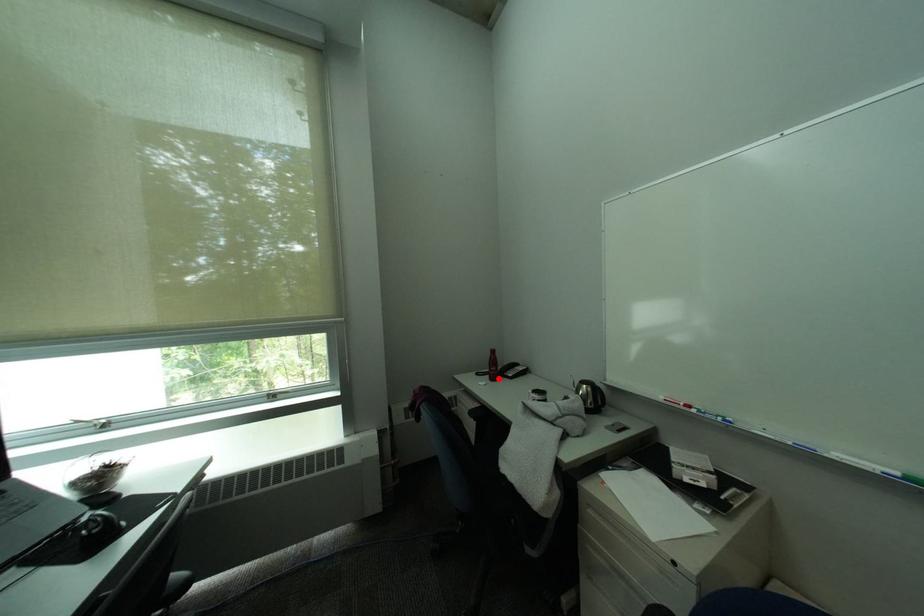
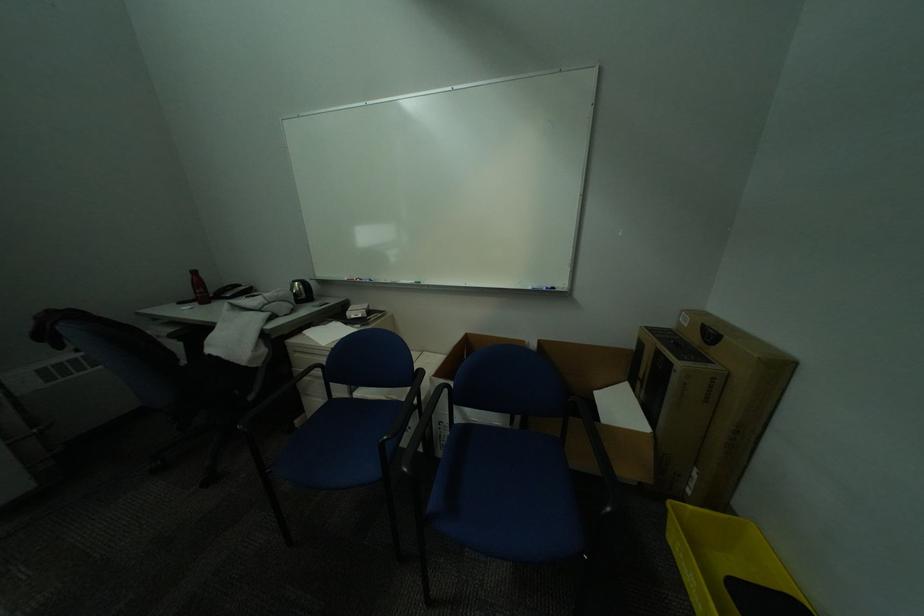
Find the pixel in the second image that matches the highlighted location in the first image.

(208, 304)